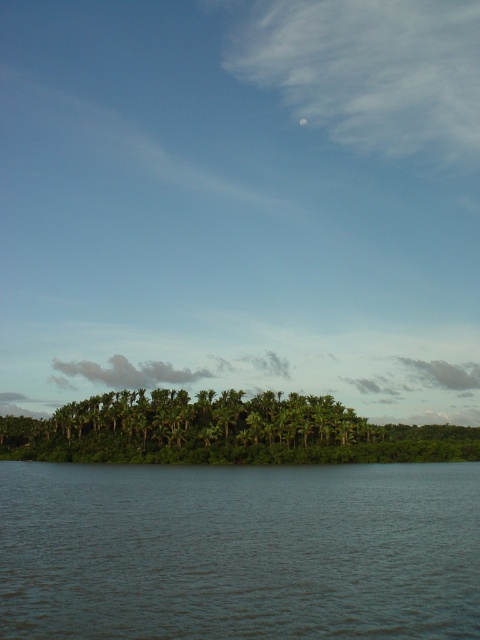
Question: Is dark blue water at lower center to the right of green leafy trees at center from the viewer's perspective?

Choices:
 (A) no
 (B) yes

Answer: (B)

Question: Which of the following is the closest to the observer?

Choices:
 (A) (463, 593)
 (B) (0, 444)

Answer: (A)

Question: Is dark blue water at lower center below green leafy trees at center?

Choices:
 (A) yes
 (B) no

Answer: (B)

Question: Is dark blue water at lower center thinner than green leafy trees at center?

Choices:
 (A) no
 (B) yes

Answer: (B)

Question: Which object appears farthest from the camera in this image?

Choices:
 (A) green leafy trees at center
 (B) dark blue water at lower center

Answer: (A)